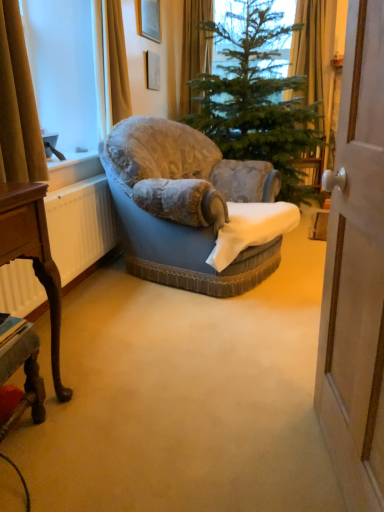
You are a GUI agent. You are given a task and a screenshot of the screen. Output one action in this format:
    pyautogui.click(x=<x>, y=<y>)
    Task: Click on the vacant space behind wooden polished desk at lower left, acting as the 2th desk starting from the bottom
    Image resolution: width=384 pixels, height=512 pixels.
    Given the screenshot: What is the action you would take?
    pyautogui.click(x=81, y=362)